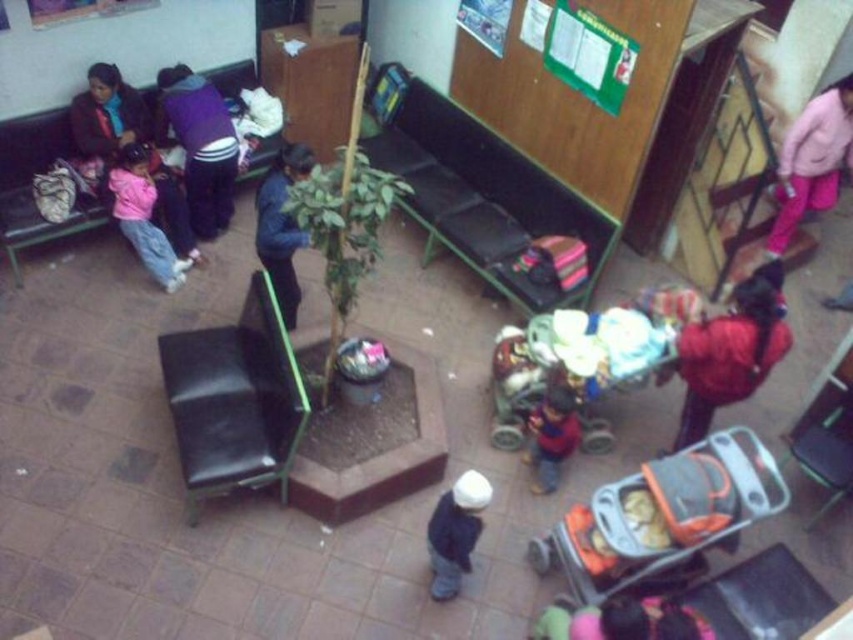
Consider the image. You are a janitor in the waiting area and need to clean the dark blue denim jacket at center. However, the green fabric bench at center is blocking your path. Can you move the bench to access the jacket?

The green fabric bench at center is positioned over dark blue denim jacket at center, meaning the bench is directly on top of the jacket. Since the bench is blocking access, you would need to move it to reach the jacket.

You are a janitor in the waiting area and need to place a new coat rack between the blue fabric jacket at center and the dark blue denim jacket at center. Since the coat rack requires 1.2 meters of space, can you fit it between them based on their sizes?

The blue fabric jacket at center is wider than the dark blue denim jacket at center. However, the exact distance between them isn

From the picture: You are a visitor in the waiting area and need to decide where to place your belongings. You have a fluffy pink blanket at lower center and a pink fleece jacket at upper left. Which item is positioned closer to the right side of the room?

The fluffy pink blanket at lower center is to the right of the pink fleece jacket at upper left, so the fluffy pink blanket at lower center is closer to the right side of the room.